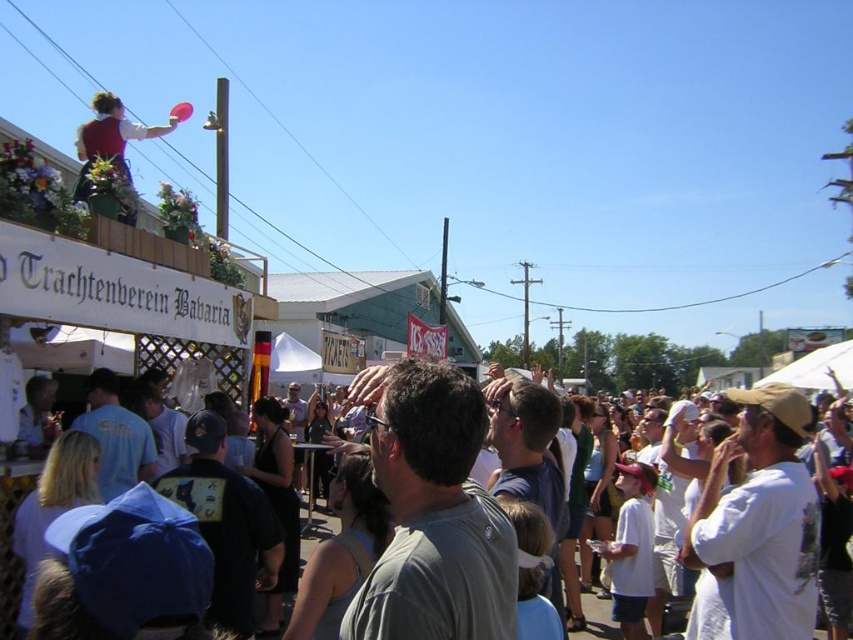
Based on the scene description, can you determine which object is shorter between the matte red vest at upper left and the white cotton crowd at center?

The matte red vest at upper left is shorter than the white cotton crowd at center because it is stated that it is not as tall as the white cotton crowd at center.

You are a photographer at the festival trying to capture a photo of the white cotton crowd at center. There is a matte red vest at upper left blocking your view. Can you move to the right to avoid it?

The matte red vest at upper left is positioned on the left side of white cotton crowd at center, so moving to the right would allow you to avoid the obstruction and capture the white cotton crowd at center without the vest blocking the view.